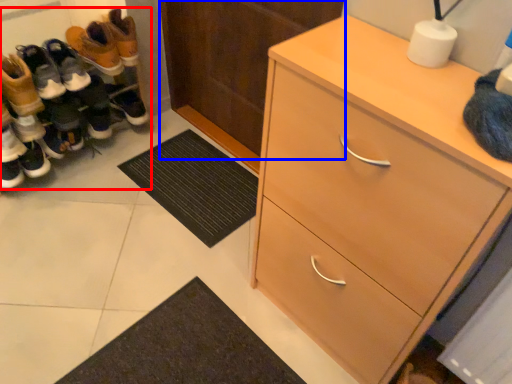
Question: Among these objects, which one is nearest to the camera, footwear (highlighted by a red box) or door (highlighted by a blue box)?

Choices:
 (A) footwear
 (B) door

Answer: (B)